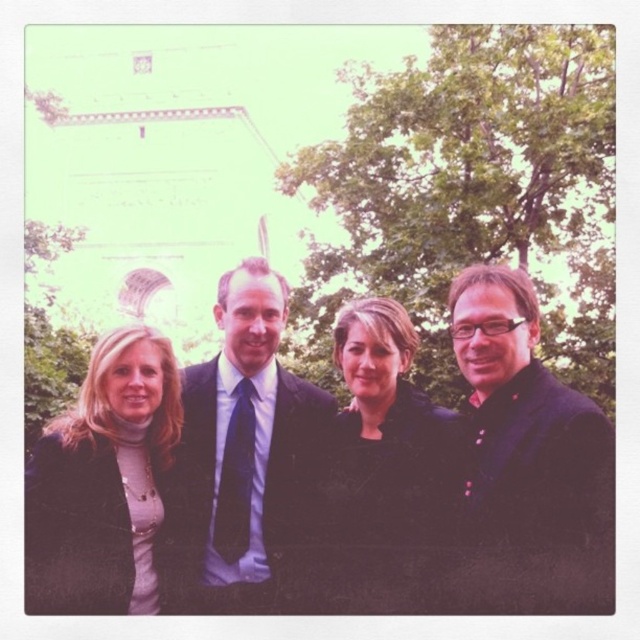
You are a photographer standing 10 meters away from the group. You need to adjust your camera to focus on both the black matte suit at center and the matte black jacket at center. Since the distance between them is 6.88 meters, will your camera be able to capture both in focus if your camera has a depth of field that can cover 8 meters?

The distance between the black matte suit at center and the matte black jacket at center is 6.88 meters, which is less than the camera depth of field of 8 meters. Therefore, the camera can capture both in focus.

What is the exact coordinate of the black matte suit at center?

The black matte suit at center is located at coordinate point (324, 481).

You are a photographer trying to adjust the focus of your camera. You notice two jackets in the image labeled as matte black jacket at center and black matte jacket at center. Which jacket should you focus on first if you want to ensure both are in focus?

Both jackets are actually the same object, so focusing on either will ensure both are in focus.